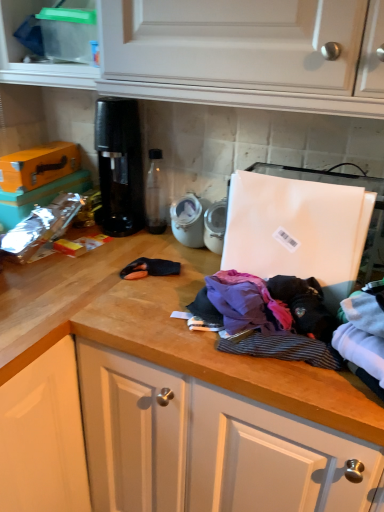
The width and height of the screenshot is (384, 512). I want to click on vacant region above striped cotton shirt at center, which ranks as the second clothing in left-to-right order (from a real-world perspective), so click(287, 332).